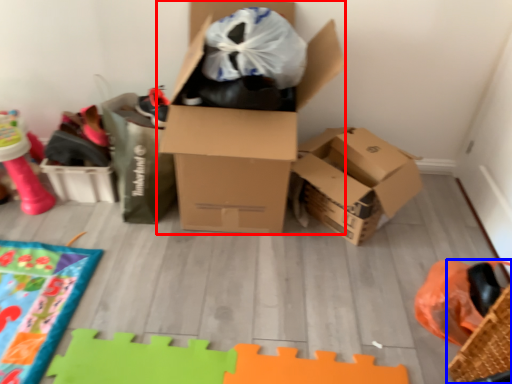
Question: Which object appears closest to the camera in this image, box (highlighted by a red box) or basket (highlighted by a blue box)?

Choices:
 (A) box
 (B) basket

Answer: (B)